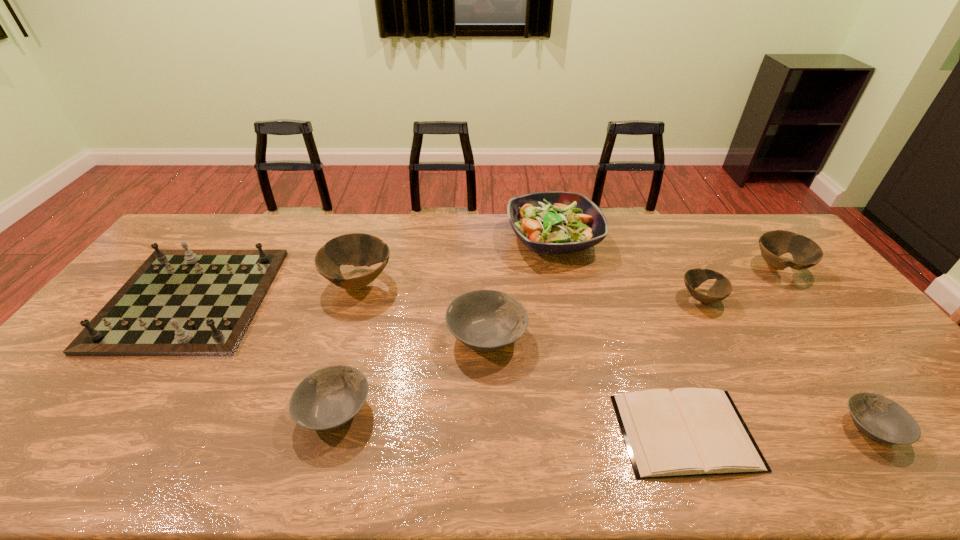
Identify the location of free spot between the third bowl from right to left and the farthest gray bowl. This screenshot has width=960, height=540. (593, 317).

The image size is (960, 540). Identify the location of unoccupied area between the fourth bowl from right to left and the second brown bowl from left to right. (593, 317).

Find the location of `unoccupied position between the second brown bowl from right to left and the rightmost brown bowl`. unoccupied position between the second brown bowl from right to left and the rightmost brown bowl is located at coordinates (740, 283).

Identify the location of vacant region between the leftmost brown bowl and the black chessboard. This screenshot has height=540, width=960. (275, 291).

Point out which object is positioned as the fifth nearest to the rightmost brown bowl. Please provide its 2D coordinates. Your answer should be formatted as a tuple, i.e. [(x, y)], where the tuple contains the x and y coordinates of a point satisfying the conditions above.

[(484, 320)]

Where is `object that is the closest to the second biggest gray bowl`? The image size is (960, 540). object that is the closest to the second biggest gray bowl is located at coordinates (484, 320).

Find the location of a particular element. This screenshot has height=540, width=960. the second closest bowl to the rightmost brown bowl is located at coordinates point(881,419).

This screenshot has width=960, height=540. In order to click on bowl identified as the closest to the third bowl from right to left in this screenshot , I will do `click(806, 253)`.

This screenshot has width=960, height=540. I want to click on brown bowl that stands as the third closest to the smallest gray bowl, so click(x=357, y=249).

I want to click on brown bowl that stands as the second closest to the shortest bowl, so click(x=806, y=253).